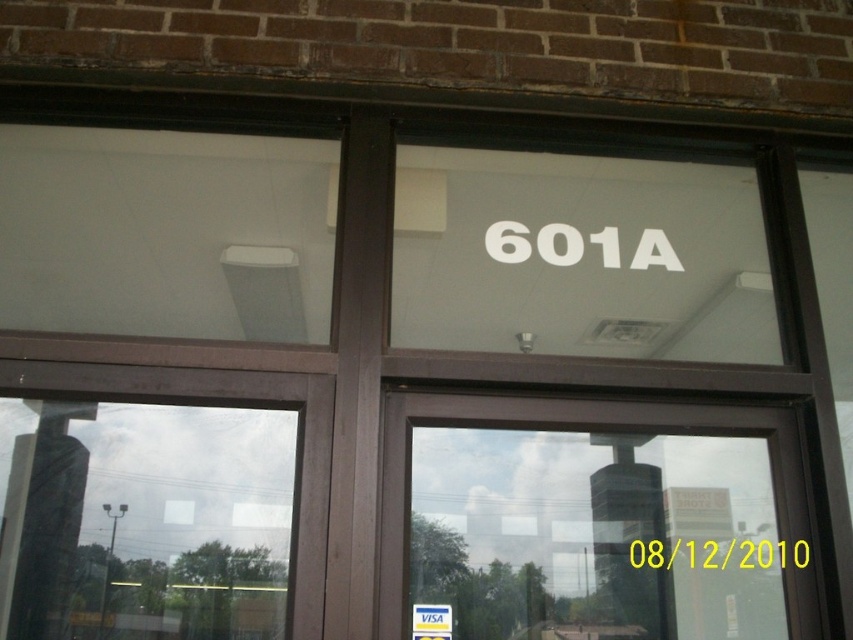
You are a delivery person holding a package for 601A. You see the transparent glass door at center and the white plastic visa card at center. Which one should you look at to confirm the correct address?

You should look at the transparent glass door at center to confirm the correct address because the white plastic visa card at center is positioned on the left side of it, meaning the door is the main feature indicating the address.

You are a delivery person holding a package and standing in front of the transparent glass door at center. You need to place the package on the white plastic visa card at center. Is the package within reach without moving your position?

The transparent glass door at center is closer to the viewer than the white plastic visa card at center, so the package can be placed on the white plastic visa card at center without moving your position.